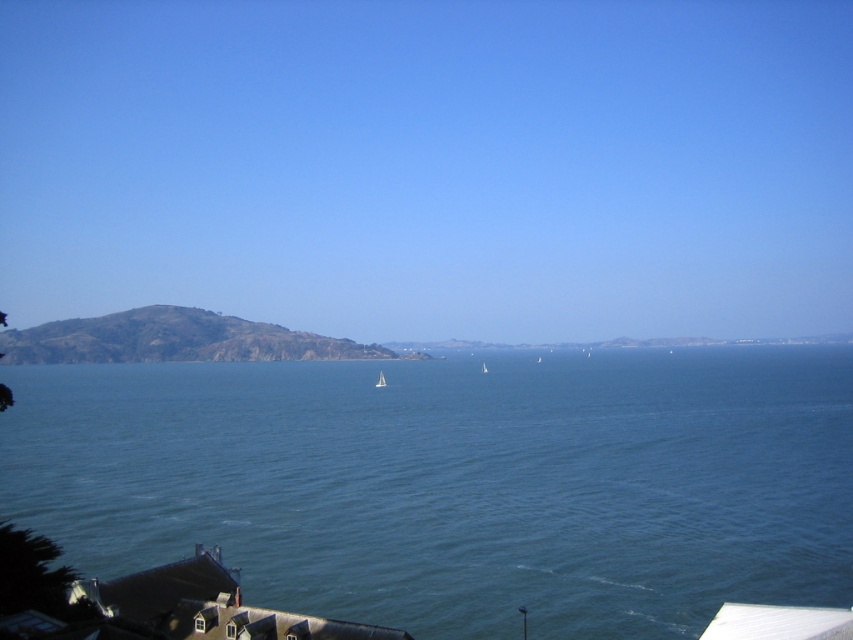
Question: Can you confirm if green grassy hill at left is positioned to the right of white glossy sailboat at center?

Choices:
 (A) yes
 (B) no

Answer: (B)

Question: Which of these objects is positioned closest to the blue water at center?

Choices:
 (A) white matte sailboat at center
 (B) green grassy hill at left

Answer: (A)

Question: Among these objects, which one is farthest from the camera?

Choices:
 (A) green grassy hill at left
 (B) white glossy sailboat at center
 (C) white matte sailboat at center
 (D) blue water at center

Answer: (A)

Question: Is blue water at center below green grassy hill at left?

Choices:
 (A) no
 (B) yes

Answer: (B)

Question: Does blue water at center appear over green grassy hill at left?

Choices:
 (A) no
 (B) yes

Answer: (A)

Question: Which point is farther to the camera?

Choices:
 (A) (141, 321)
 (B) (480, 371)

Answer: (A)